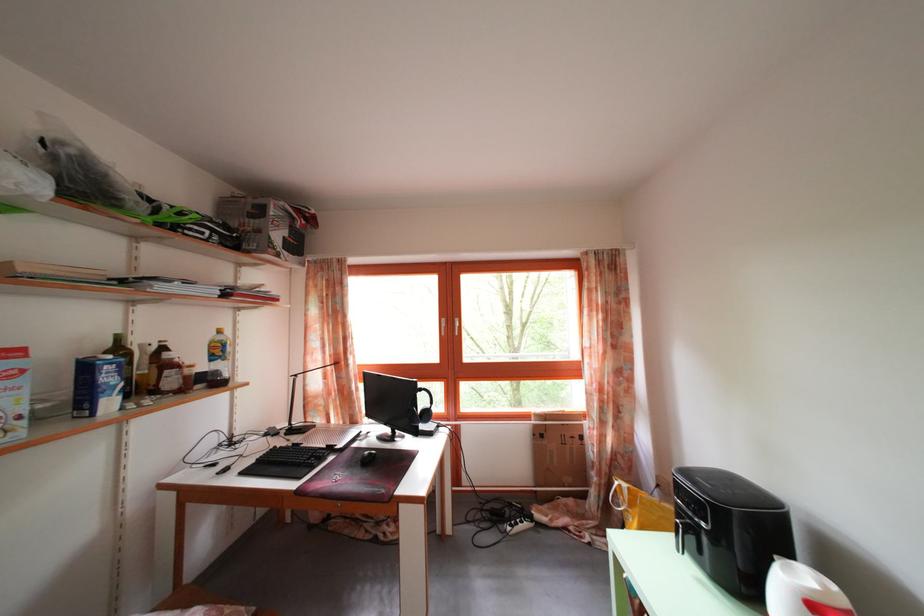
Describe the element at coordinates (96, 386) in the screenshot. The image size is (924, 616). I see `the blue milk carton` at that location.